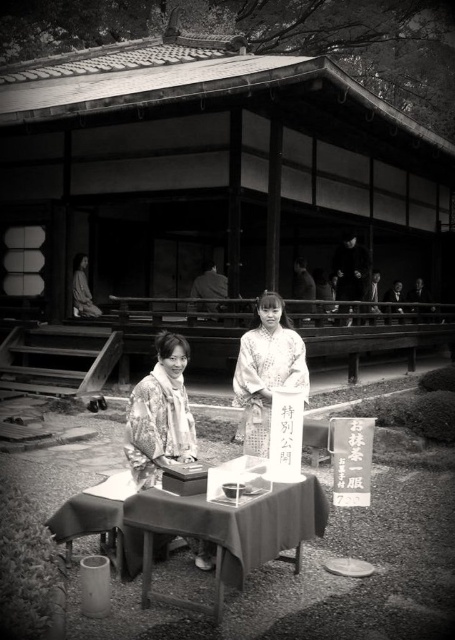
In the scene of a traditional Japanese tea ceremony, there are two people wearing kimonos. One is wearing a floral kimono at center and the other a silky white kimono at center. Which kimono is smaller in size?

The floral kimono at center has a smaller size compared to the silky white kimono at center.

You are a photographer adjusting your camera to capture the tea ceremony scene. You notice two points in the image labeled as point (266, 548) and point (166, 442). Which of these points is closer to your camera lens?

Point (266, 548) is closer to the camera lens than point (166, 442).